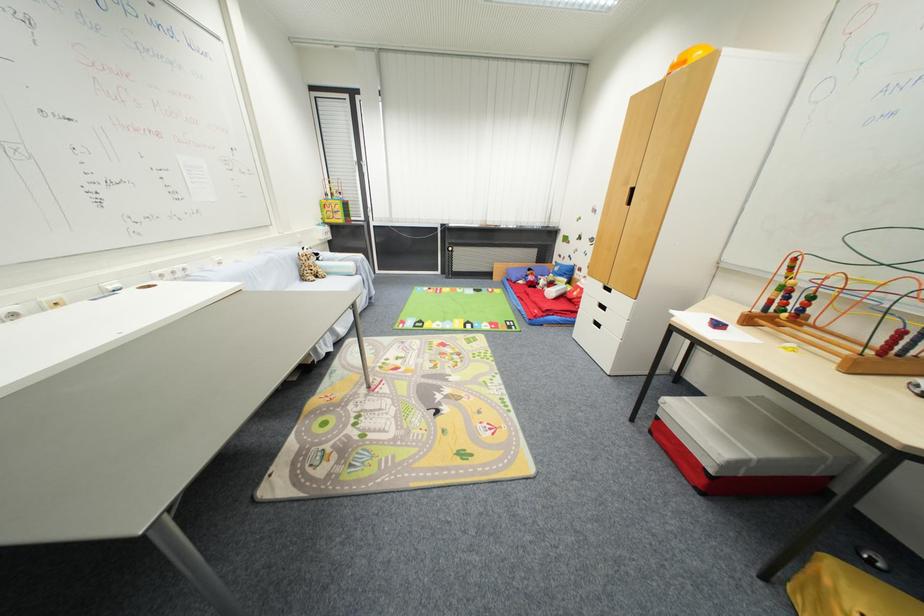
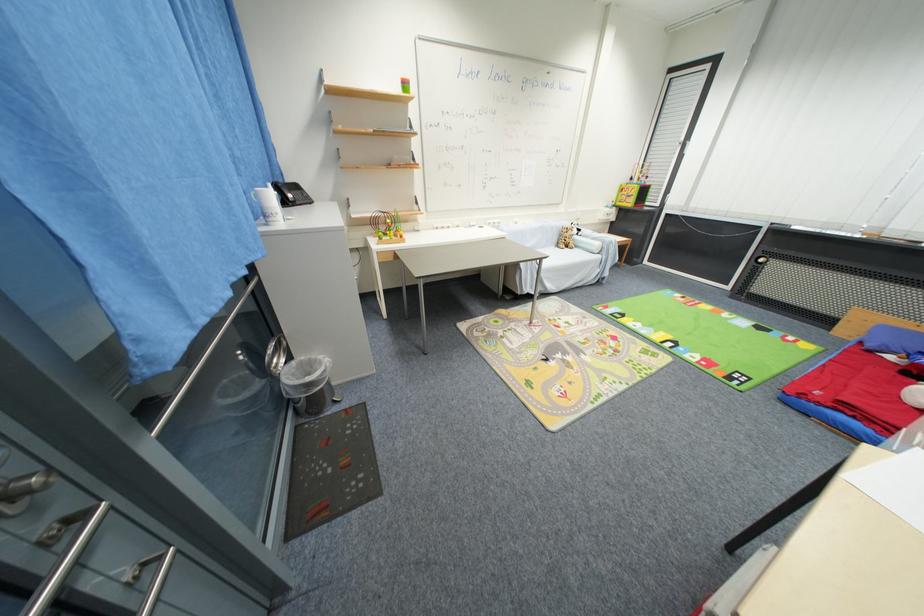
Find the pixel in the second image that matches point (345, 222) in the first image.

(635, 206)